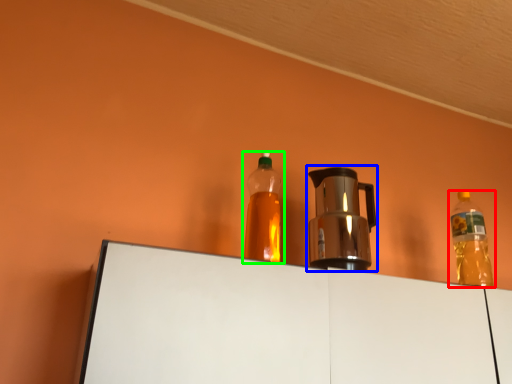
Question: Estimate the real-world distances between objects in this image. Which object is farther from bottle (highlighted by a red box), coffeepot (highlighted by a blue box) or bottle (highlighted by a green box)?

Choices:
 (A) coffeepot
 (B) bottle

Answer: (B)